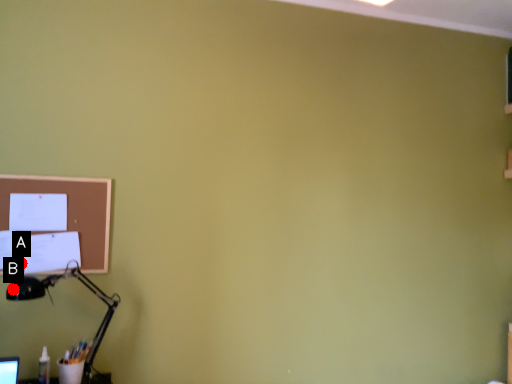
Question: Two points are circled on the image, labeled by A and B beside each circle. Which point is closer to the camera?

Choices:
 (A) A is closer
 (B) B is closer

Answer: (B)